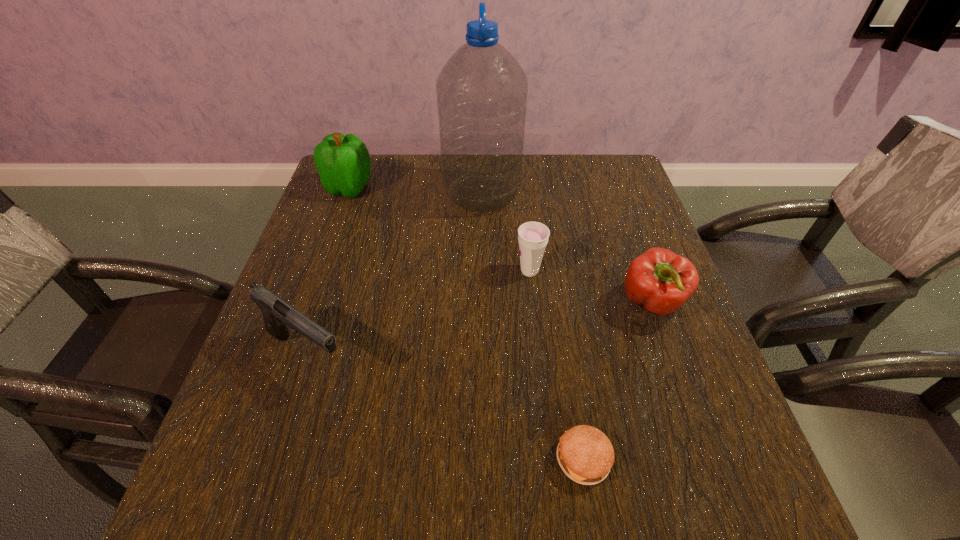
This screenshot has width=960, height=540. Find the location of `free space between the water jug and the nearer bell pepper`. free space between the water jug and the nearer bell pepper is located at coordinates (567, 249).

Locate an element on the screen. vacant space in between the hamburger and the left bell pepper is located at coordinates (467, 323).

I want to click on free point between the nearest object and the left bell pepper, so click(x=467, y=323).

Locate an element on the screen. This screenshot has width=960, height=540. vacant space in between the cup and the water jug is located at coordinates (506, 232).

Locate an element on the screen. The width and height of the screenshot is (960, 540). unoccupied area between the hamburger and the left bell pepper is located at coordinates (467, 323).

The height and width of the screenshot is (540, 960). Identify the location of free point between the shortest object and the tallest object. (533, 327).

Image resolution: width=960 pixels, height=540 pixels. I want to click on free space between the rightmost object and the water jug, so click(x=567, y=249).

Where is `the third closest object to the gun`? the third closest object to the gun is located at coordinates (482, 91).

The width and height of the screenshot is (960, 540). What are the coordinates of `object identified as the fifth closest to the shortest object` in the screenshot? It's located at (343, 162).

Where is `blank space that satisfies the following two spatial constraints: 1. on the front side of the hamburger; 2. on the right side of the taller bell pepper`? The image size is (960, 540). blank space that satisfies the following two spatial constraints: 1. on the front side of the hamburger; 2. on the right side of the taller bell pepper is located at coordinates (253, 459).